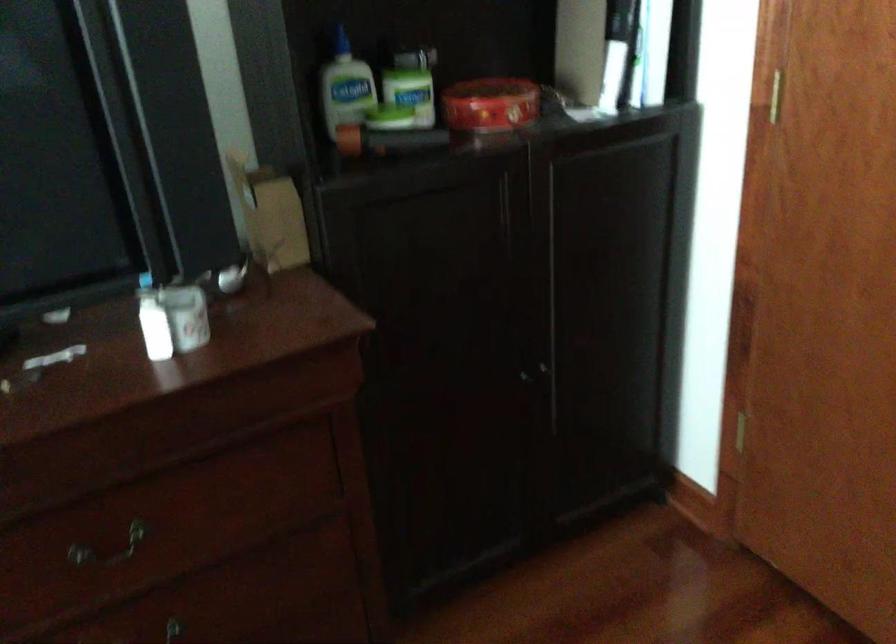
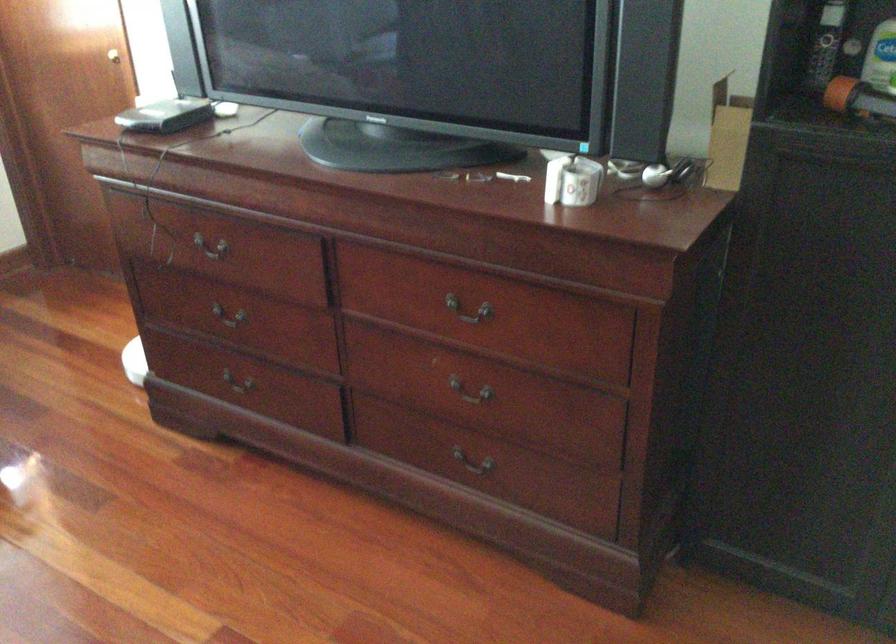
Find the pixel in the second image that matches (x=177, y=316) in the first image.

(572, 180)